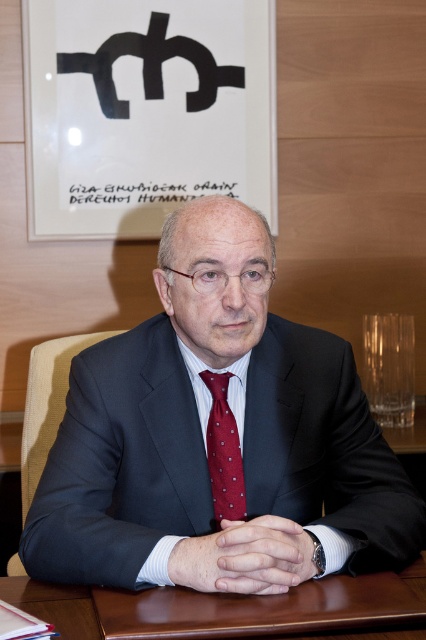
Which is more to the right, dark suit at center or brown wooden table at center?

dark suit at center

Does dark suit at center lie in front of brown wooden table at center?

No, it is not.

Between point (304, 474) and point (354, 580), which one is positioned behind?

The point (304, 474) is behind.

Find the location of `dark suit at center`. dark suit at center is located at coordinates (218, 436).

Who is positioned more to the left, brown wooden table at center or white textured dress shirt at center?

From the viewer's perspective, brown wooden table at center appears more on the left side.

Can you confirm if brown wooden table at center is positioned below white textured dress shirt at center?

Correct, brown wooden table at center is located below white textured dress shirt at center.

Find the location of a particular element. The image size is (426, 640). brown wooden table at center is located at coordinates (224, 605).

Is polished silk tie at center smaller than white textured dress shirt at center?

Indeed, polished silk tie at center has a smaller size compared to white textured dress shirt at center.

You are a GUI agent. You are given a task and a screenshot of the screen. Output one action in this format:
    pyautogui.click(x=<x>, y=<y>)
    Task: Click on the polished silk tie at center
    The image size is (426, 640).
    Given the screenshot: What is the action you would take?
    pyautogui.click(x=224, y=452)

This screenshot has height=640, width=426. I want to click on polished silk tie at center, so click(x=224, y=452).